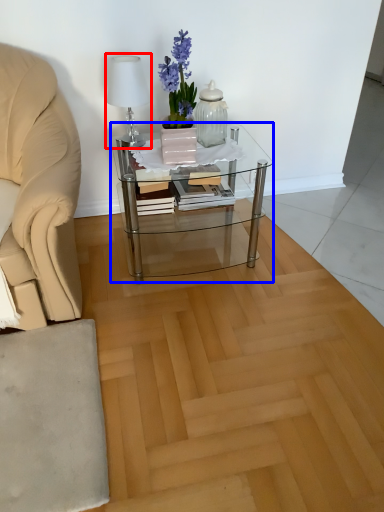
Question: Which point is closer to the camera, table lamp (highlighted by a red box) or coffee table (highlighted by a blue box)?

Choices:
 (A) table lamp
 (B) coffee table

Answer: (A)